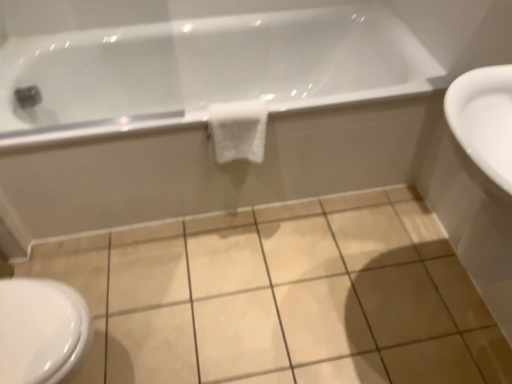
Identify the location of vacant space situated above white glossy bidet at lower left (from a real-world perspective). (32, 320).